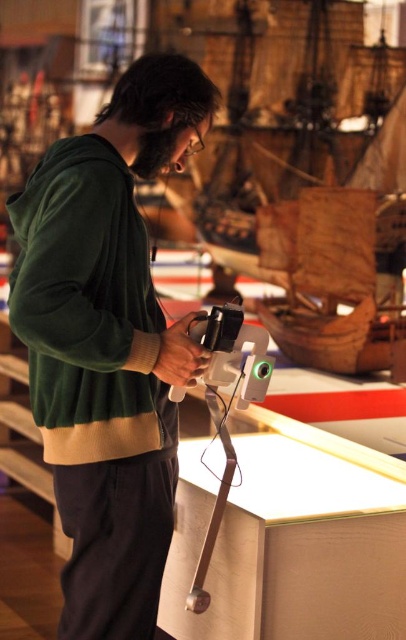
You are a museum visitor who wants to touch the green velvety sweatshirt at left located at point [88,307]. The museum has a rule that you can only touch objects within 1 meter. You are currently standing at the center of the room. Can you reach it?

The green velvety sweatshirt at left is located at point [88,307]. Since you are at the center of the room, the distance to the point is calculated using coordinates. However, without knowing the room dimensions or coordinate system scale, it is impossible to determine if it is within 1 meter. Please check the museum guidelines for clarification.

Looking at this image, you are a photographer trying to capture the green velvety sweatshirt at left and the matte black video camera at center in a single frame. Since the camera has a limited field of view, will you be able to include both objects in the photo without moving the camera?

The green velvety sweatshirt at left is positioned on the left side of the matte black video camera at center, so yes, both objects can be captured in the same frame as long as the camera is aimed towards the center area where the matte black video camera at center is located and the field of view is wide enough to include the left side where the green velvety sweatshirt at left is positioned.

You are a museum security guard checking the dimensions of the green soft sweater at center and the matte black video camera at center. Which object has a greater width?

The green soft sweater at center has a larger width than the matte black video camera at center.